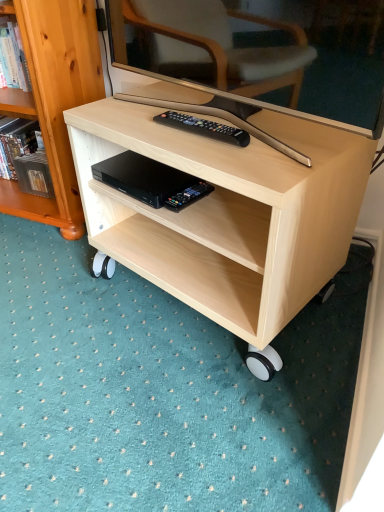
Question: Relative to light wood/texture bookcase at left, is black plastic remote control at lower center in front or behind?

Choices:
 (A) behind
 (B) front

Answer: (B)

Question: Visually, is black plastic remote control at lower center positioned to the left or to the right of light wood/texture bookcase at left?

Choices:
 (A) right
 (B) left

Answer: (A)

Question: Which object is the closest to the black plastic remote at center?

Choices:
 (A) black plastic remote control at lower center
 (B) light wood desk at center
 (C) light wood/texture bookcase at left

Answer: (A)

Question: Which object is positioned closest to the light wood desk at center?

Choices:
 (A) black plastic remote at center
 (B) light wood/texture bookcase at left
 (C) black plastic remote control at lower center

Answer: (A)